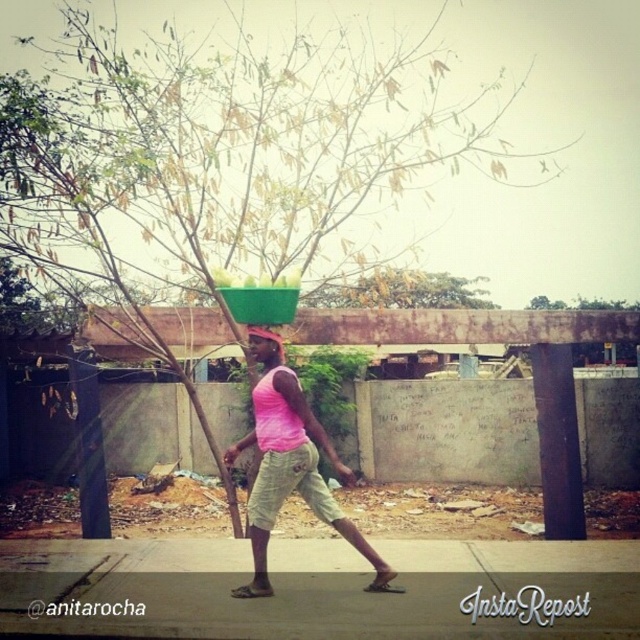
Does gray concrete pavement at lower center have a lesser width compared to pink fabric tank top at center?

Incorrect, gray concrete pavement at lower center's width is not less than pink fabric tank top at center's.

Which of these two, gray concrete pavement at lower center or pink fabric tank top at center, stands shorter?

gray concrete pavement at lower center is shorter.

Where is `gray concrete pavement at lower center`? The width and height of the screenshot is (640, 640). gray concrete pavement at lower center is located at coordinates (344, 588).

This screenshot has height=640, width=640. Identify the location of gray concrete pavement at lower center. (344, 588).

Can you confirm if pink fabric tank top at center is positioned to the right of pink fabric head at center?

Indeed, pink fabric tank top at center is positioned on the right side of pink fabric head at center.

Is point (227, 451) behind point (278, 356)?

Yes, it is behind point (278, 356).

Is point (257, 516) positioned in front of point (269, 339)?

Yes, it is in front of point (269, 339).

This screenshot has width=640, height=640. In order to click on pink fabric tank top at center in this screenshot , I will do 291,468.

Who is shorter, gray concrete pavement at lower center or pink fabric head at center?

gray concrete pavement at lower center is shorter.

Who is more forward, (163, 579) or (259, 332)?

Point (259, 332)

Image resolution: width=640 pixels, height=640 pixels. In order to click on gray concrete pavement at lower center in this screenshot , I will do `click(344, 588)`.